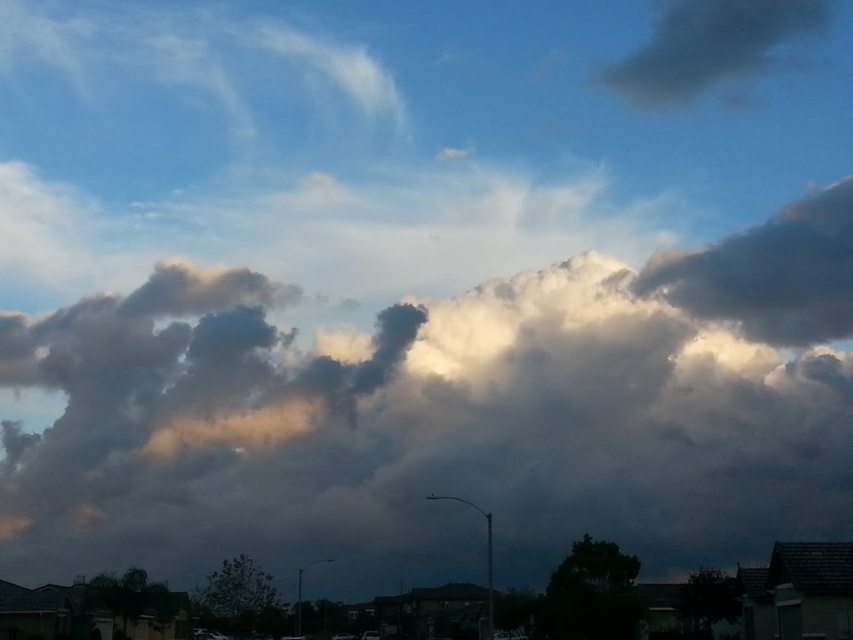
Question: Among these objects, which one is nearest to the camera?

Choices:
 (A) dark gray cloud at upper right
 (B) cloudy at upper center

Answer: (B)

Question: Is the position of cloudy at upper center more distant than that of dark green leafy tree at lower center?

Choices:
 (A) yes
 (B) no

Answer: (A)

Question: Which object appears closest to the camera in this image?

Choices:
 (A) cloudy at upper center
 (B) dark green leafy tree at lower center
 (C) dark gray cloud at upper right

Answer: (B)

Question: Is cloudy at upper center smaller than dark gray cloud at upper right?

Choices:
 (A) no
 (B) yes

Answer: (A)

Question: Is cloudy at upper center wider than dark gray cloud at upper right?

Choices:
 (A) yes
 (B) no

Answer: (A)

Question: Among these points, which one is nearest to the camera?

Choices:
 (A) (0, 520)
 (B) (611, 621)
 (C) (682, 19)

Answer: (B)